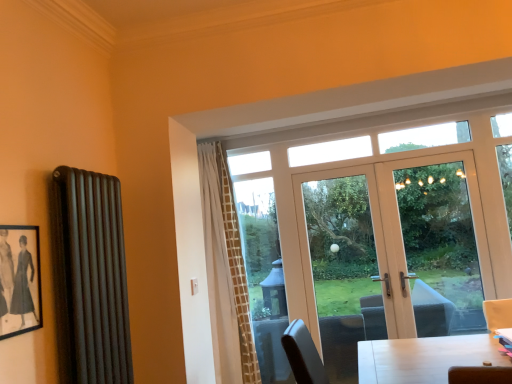
Identify the location of empty space that is ontop of clear glass door at center. [334, 162].